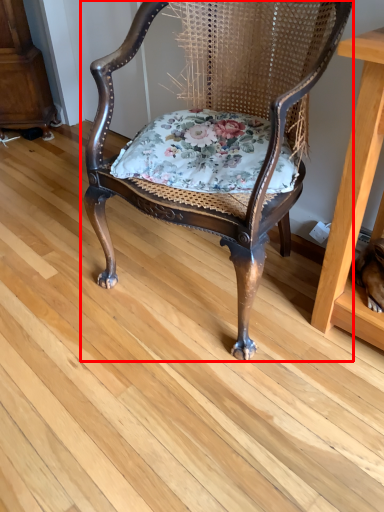
Question: From the image, what is the correct spatial relationship of chair (annotated by the red box) in relation to blanket?

Choices:
 (A) left
 (B) right

Answer: (B)